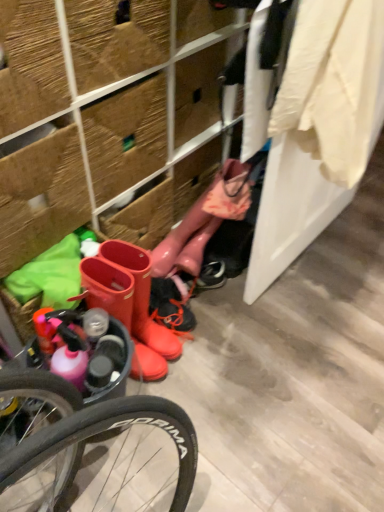
Question: Considering the relative sizes of rubber boots at center and glossy rubber boot at center in the image provided, is rubber boots at center bigger than glossy rubber boot at center?

Choices:
 (A) no
 (B) yes

Answer: (B)

Question: Can you confirm if rubber boots at center is taller than glossy rubber boot at center?

Choices:
 (A) no
 (B) yes

Answer: (B)

Question: From a real-world perspective, is rubber boots at center on top of glossy rubber boot at center?

Choices:
 (A) no
 (B) yes

Answer: (A)

Question: From the image's perspective, is rubber boots at center over glossy rubber boot at center?

Choices:
 (A) no
 (B) yes

Answer: (A)

Question: Can you confirm if rubber boots at center is wider than glossy rubber boot at center?

Choices:
 (A) no
 (B) yes

Answer: (B)

Question: Can we say rubber boots at center lies outside glossy rubber boot at center?

Choices:
 (A) no
 (B) yes

Answer: (B)

Question: Can you confirm if rubber boots at center is bigger than rubber boots at lower left?

Choices:
 (A) no
 (B) yes

Answer: (A)

Question: Is rubber boots at center next to rubber boots at lower left and touching it?

Choices:
 (A) no
 (B) yes

Answer: (A)

Question: Would you say rubber boots at center contains rubber boots at lower left?

Choices:
 (A) yes
 (B) no

Answer: (B)

Question: Does rubber boots at center lie behind rubber boots at lower left?

Choices:
 (A) yes
 (B) no

Answer: (A)

Question: Is rubber boots at center aimed at rubber boots at lower left?

Choices:
 (A) no
 (B) yes

Answer: (A)

Question: Is there a large distance between rubber boots at center and rubber boots at lower left?

Choices:
 (A) yes
 (B) no

Answer: (B)

Question: From the image's perspective, is glossy rubber boot at center under rubber boots at lower left?

Choices:
 (A) yes
 (B) no

Answer: (A)